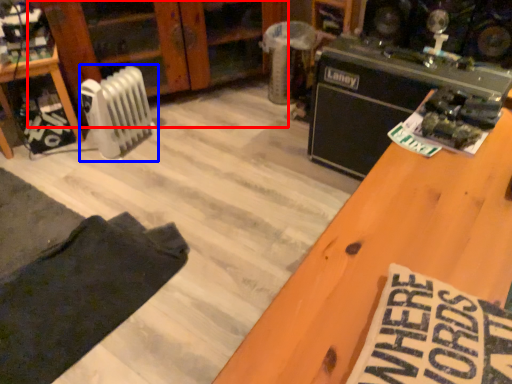
Question: Among these objects, which one is nearest to the camera, dresser (highlighted by a red box) or radiator (highlighted by a blue box)?

Choices:
 (A) dresser
 (B) radiator

Answer: (B)